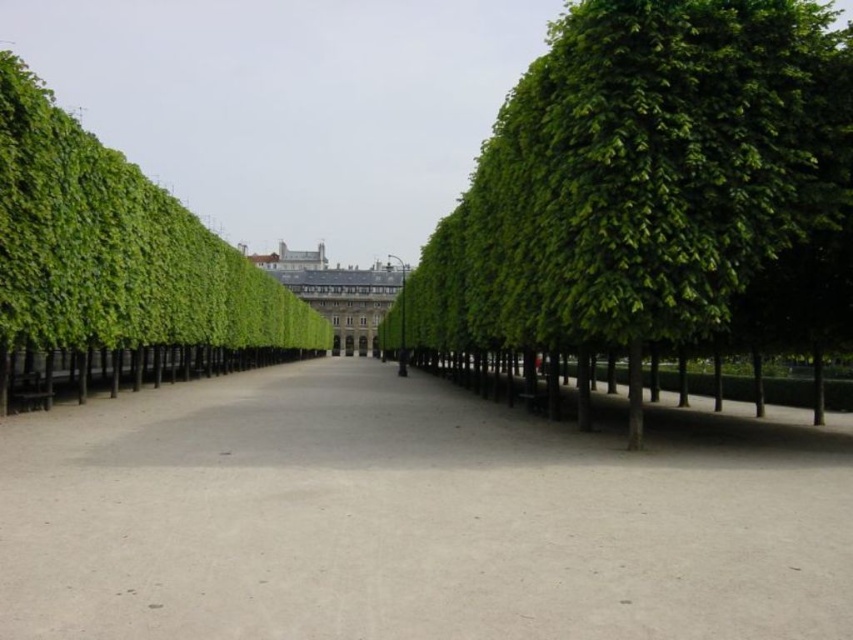
Question: Considering the real-world distances, which object is closest to the green leafy bush at left?

Choices:
 (A) white stone building at center
 (B) gray concrete alley at center
 (C) green leafy tree at center

Answer: (C)

Question: Is green leafy bush at left below white stone building at center?

Choices:
 (A) yes
 (B) no

Answer: (A)

Question: In this image, where is gray concrete alley at center located relative to green leafy bush at left?

Choices:
 (A) left
 (B) right

Answer: (B)

Question: Estimate the real-world distances between objects in this image. Which object is closer to the white stone building at center?

Choices:
 (A) gray concrete alley at center
 (B) green leafy tree at center

Answer: (B)

Question: Does gray concrete alley at center lie behind green leafy tree at center?

Choices:
 (A) no
 (B) yes

Answer: (A)

Question: Which object is the closest to the gray concrete alley at center?

Choices:
 (A) green leafy tree at center
 (B) white stone building at center
 (C) green leafy bush at left

Answer: (A)